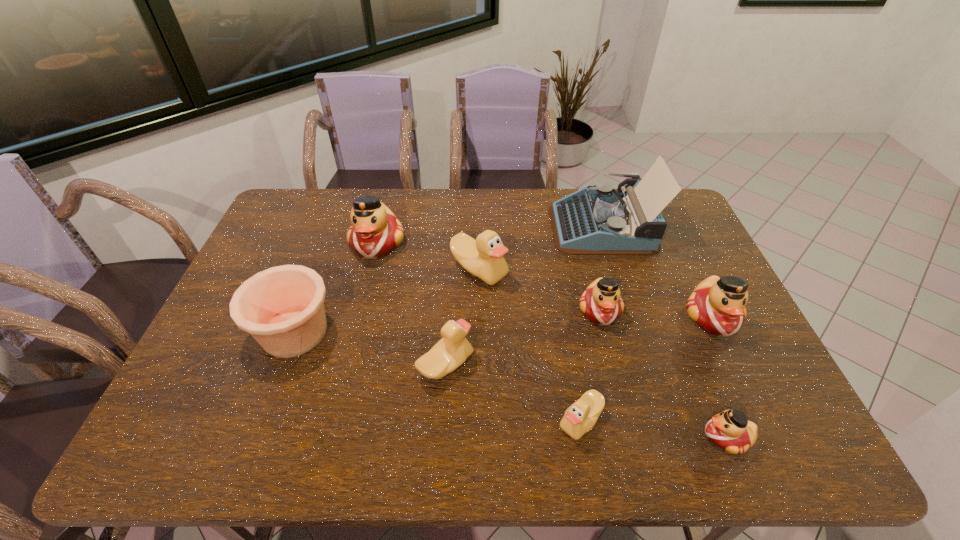
Where is `vacant area that lies between the farthest beige duck and the second biggest beige duck`? This screenshot has width=960, height=540. vacant area that lies between the farthest beige duck and the second biggest beige duck is located at coordinates pyautogui.click(x=463, y=318).

The height and width of the screenshot is (540, 960). I want to click on unoccupied area between the rightmost beige duck and the typewriter, so click(x=591, y=323).

Identify which object is the sixth closest to the pottery. Please provide its 2D coordinates. Your answer should be formatted as a tuple, i.e. [(x, y)], where the tuple contains the x and y coordinates of a point satisfying the conditions above.

[(601, 302)]

Where is `the fourth closest object to the smallest red duck`? This screenshot has height=540, width=960. the fourth closest object to the smallest red duck is located at coordinates (450, 352).

This screenshot has height=540, width=960. In order to click on the fourth closest duck to the farthest beige duck in this screenshot , I will do `click(579, 418)`.

Find the location of a particular element. This screenshot has width=960, height=540. duck that is the sixth closest to the leftmost duck is located at coordinates (730, 430).

Locate which red duck ranks third in proximity to the biggest red duck. Please provide its 2D coordinates. Your answer should be formatted as a tuple, i.e. [(x, y)], where the tuple contains the x and y coordinates of a point satisfying the conditions above.

[(730, 430)]

Image resolution: width=960 pixels, height=540 pixels. What are the coordinates of `red duck that stands as the closest to the biggest red duck` in the screenshot? It's located at (601, 302).

Point out which beige duck is positioned as the third nearest to the second biggest red duck. Please provide its 2D coordinates. Your answer should be formatted as a tuple, i.e. [(x, y)], where the tuple contains the x and y coordinates of a point satisfying the conditions above.

[(450, 352)]

Where is `beige duck that is the closest to the biggest beige duck`? beige duck that is the closest to the biggest beige duck is located at coordinates (450, 352).